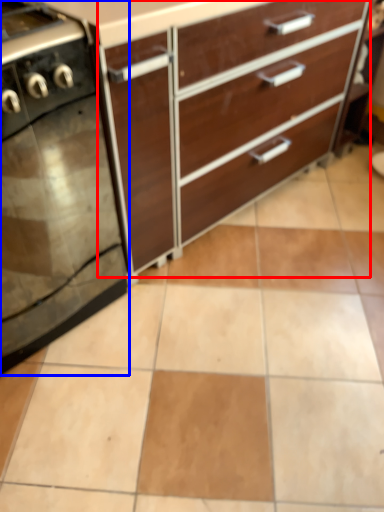
Question: Which point is closer to the camera, chest of drawers (highlighted by a red box) or home appliance (highlighted by a blue box)?

Choices:
 (A) chest of drawers
 (B) home appliance

Answer: (B)